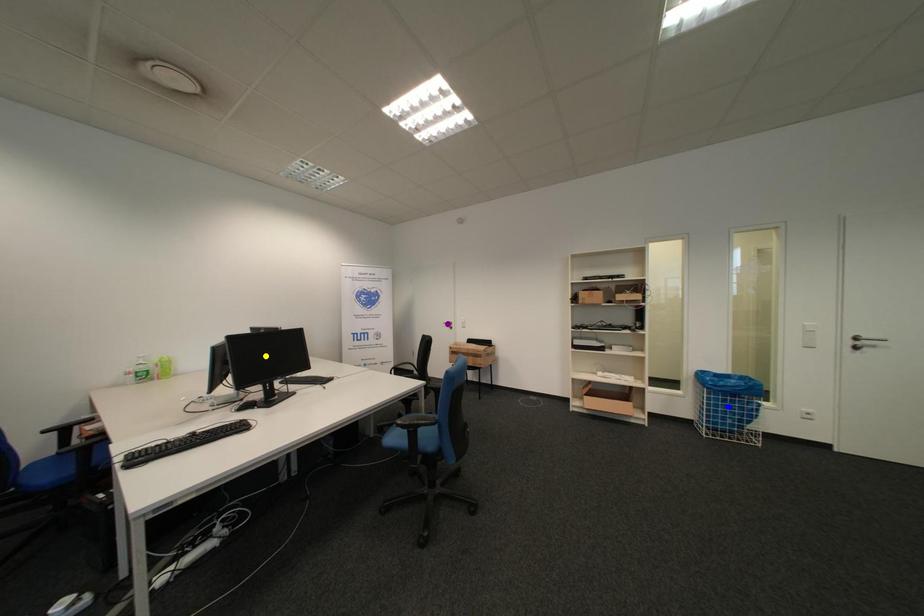
Order these from nearest to farthest:
A) purple point
B) yellow point
C) blue point

1. yellow point
2. blue point
3. purple point